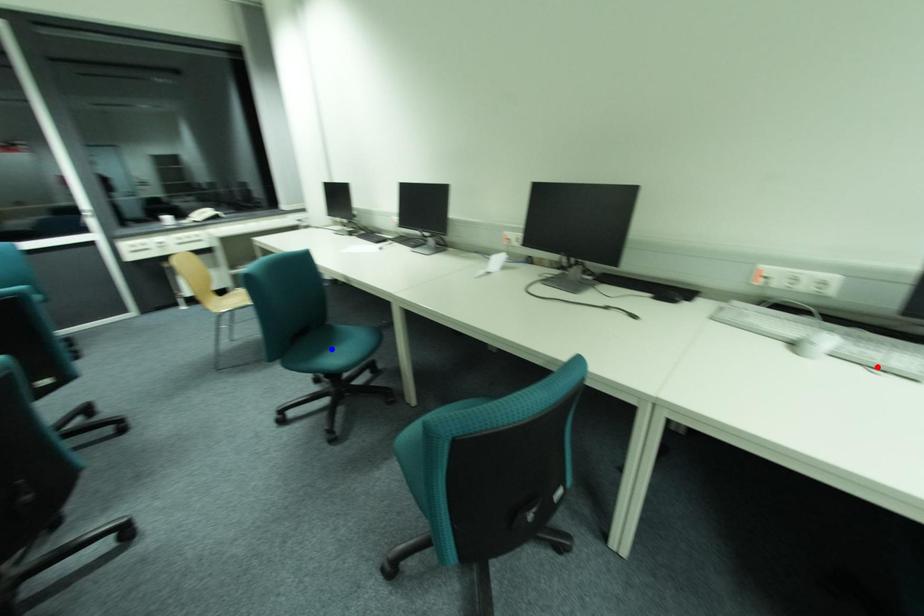
Question: In the image, two points are highlighted. Which point is nearer to the camera? Reply with the corresponding letter.

Choices:
 (A) blue point
 (B) red point

Answer: (B)